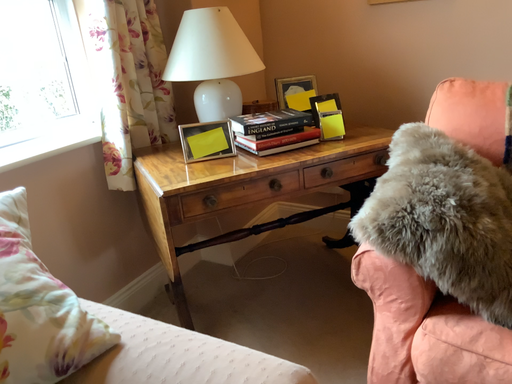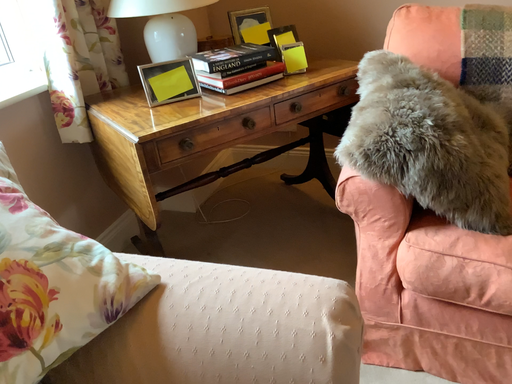
Question: How did the camera likely rotate when shooting the video?

Choices:
 (A) rotated downward
 (B) rotated upward

Answer: (A)